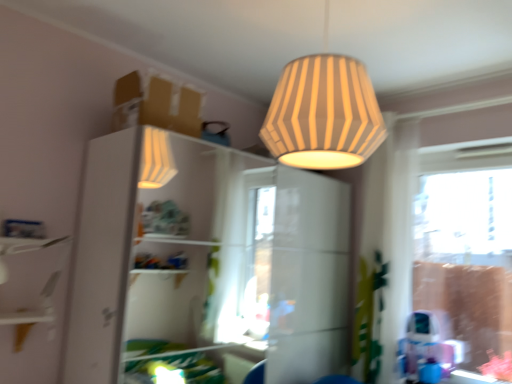
Question: Does white glossy shelf at left have a greater width compared to white glossy dresser at upper center?

Choices:
 (A) no
 (B) yes

Answer: (A)

Question: Can you confirm if white glossy shelf at left is shorter than white glossy dresser at upper center?

Choices:
 (A) no
 (B) yes

Answer: (B)

Question: Is white glossy dresser at upper center a part of white glossy shelf at left?

Choices:
 (A) yes
 (B) no

Answer: (B)

Question: Is white glossy shelf at left smaller than white glossy dresser at upper center?

Choices:
 (A) no
 (B) yes

Answer: (B)

Question: Does white glossy shelf at left have a greater height compared to white glossy dresser at upper center?

Choices:
 (A) yes
 (B) no

Answer: (B)

Question: From a real-world perspective, is striped paper lampshade at upper center above or below white glossy dresser at upper center?

Choices:
 (A) below
 (B) above

Answer: (B)

Question: Relative to white glossy dresser at upper center, is striped paper lampshade at upper center in front or behind?

Choices:
 (A) behind
 (B) front

Answer: (B)

Question: Based on their sizes in the image, would you say striped paper lampshade at upper center is bigger or smaller than white glossy dresser at upper center?

Choices:
 (A) big
 (B) small

Answer: (B)

Question: Is point (348, 61) positioned closer to the camera than point (94, 142)?

Choices:
 (A) farther
 (B) closer

Answer: (B)

Question: Visually, is striped paper lampshade at upper center positioned to the left or to the right of clear glass window at right?

Choices:
 (A) left
 (B) right

Answer: (A)

Question: From the image's perspective, is striped paper lampshade at upper center above or below clear glass window at right?

Choices:
 (A) above
 (B) below

Answer: (A)

Question: Is striped paper lampshade at upper center taller or shorter than clear glass window at right?

Choices:
 (A) tall
 (B) short

Answer: (B)

Question: Is point (303, 112) closer or farther from the camera than point (453, 218)?

Choices:
 (A) closer
 (B) farther

Answer: (A)

Question: In the image, is white glossy dresser at upper center positioned in front of or behind clear glass window at right?

Choices:
 (A) behind
 (B) front

Answer: (B)

Question: Looking at the image, does white glossy dresser at upper center seem bigger or smaller compared to clear glass window at right?

Choices:
 (A) small
 (B) big

Answer: (B)